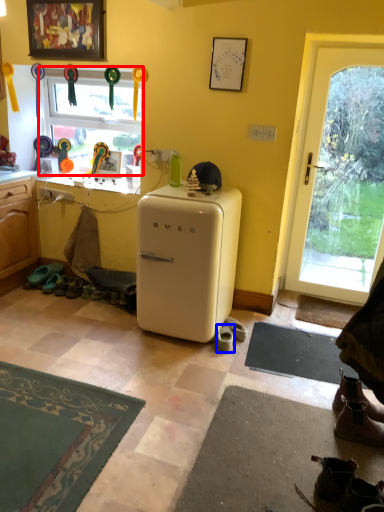
Question: Which object appears closest to the camera in this image, window (highlighted by a red box) or footwear (highlighted by a blue box)?

Choices:
 (A) window
 (B) footwear

Answer: (B)